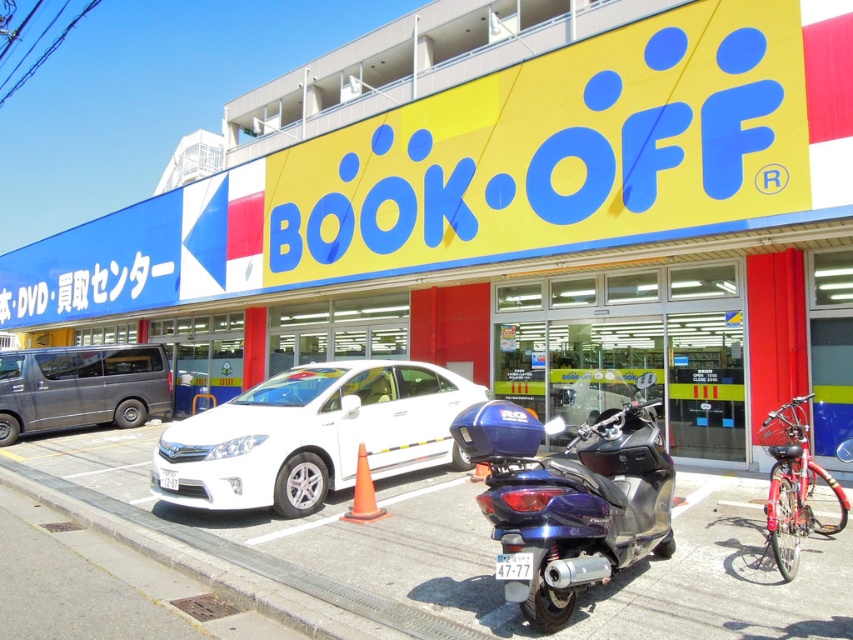
Does metallic blue scooter at center appear under orange matte cone at center?

Actually, metallic blue scooter at center is above orange matte cone at center.

What do you see at coordinates (569, 499) in the screenshot? I see `metallic blue scooter at center` at bounding box center [569, 499].

You are a GUI agent. You are given a task and a screenshot of the screen. Output one action in this format:
    pyautogui.click(x=<x>, y=<y>)
    Task: Click on the metallic blue scooter at center
    
    Given the screenshot: What is the action you would take?
    pyautogui.click(x=569, y=499)

Does point (44, 404) come in front of point (364, 481)?

No, it is not.

Who is shorter, silver metallic van at left or orange matte cone at center?

orange matte cone at center is shorter.

Image resolution: width=853 pixels, height=640 pixels. Find the location of `silver metallic van at left`. silver metallic van at left is located at coordinates (80, 387).

I want to click on silver metallic van at left, so click(x=80, y=387).

Who is taller, white glossy sedan at center or silver metallic van at left?

silver metallic van at left is taller.

Consider the image. Is white glossy sedan at center wider than silver metallic van at left?

Correct, the width of white glossy sedan at center exceeds that of silver metallic van at left.

Image resolution: width=853 pixels, height=640 pixels. Find the location of `white glossy sedan at center`. white glossy sedan at center is located at coordinates (311, 435).

I want to click on white glossy sedan at center, so click(311, 435).